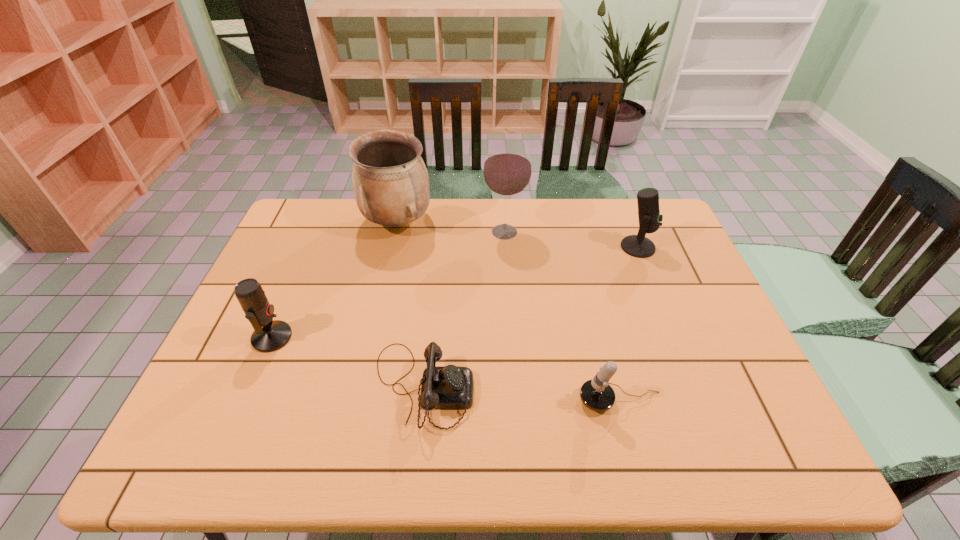
The height and width of the screenshot is (540, 960). What are the coordinates of `vacant area that lies between the leftmost object and the farthest microphone` in the screenshot? It's located at (455, 292).

The height and width of the screenshot is (540, 960). I want to click on free spot between the second microphone from right to left and the shortest object, so click(521, 394).

Where is `empty space that is in between the third object from right to left and the second microphone from left to right`? The image size is (960, 540). empty space that is in between the third object from right to left and the second microphone from left to right is located at coordinates (563, 316).

At what (x,y) coordinates should I click in order to perform the action: click on free space between the telephone and the rightmost object. Please return your answer as a coordinate pair (x, y). Looking at the image, I should click on (530, 317).

Find the location of a particular element. The height and width of the screenshot is (540, 960). vacant area that lies between the telephone and the farthest microphone is located at coordinates (x=530, y=317).

Select which object is the closest to the shortest object. Please provide its 2D coordinates. Your answer should be formatted as a tuple, i.e. [(x, y)], where the tuple contains the x and y coordinates of a point satisfying the conditions above.

[(270, 335)]

Point out which object is positioned as the nearest to the leftmost object. Please provide its 2D coordinates. Your answer should be formatted as a tuple, i.e. [(x, y)], where the tuple contains the x and y coordinates of a point satisfying the conditions above.

[(443, 387)]

I want to click on the third closest microphone to the shortest object, so click(650, 220).

You are a GUI agent. You are given a task and a screenshot of the screen. Output one action in this format:
    pyautogui.click(x=<x>, y=<y>)
    Task: Click on the microphone that is the second closest to the fifth object from left to right
    
    Given the screenshot: What is the action you would take?
    pyautogui.click(x=270, y=335)

The image size is (960, 540). I want to click on blank area in the image that satisfies the following two spatial constraints: 1. on the front side of the third object from right to left; 2. on the front-facing side of the shortest object, so point(515,387).